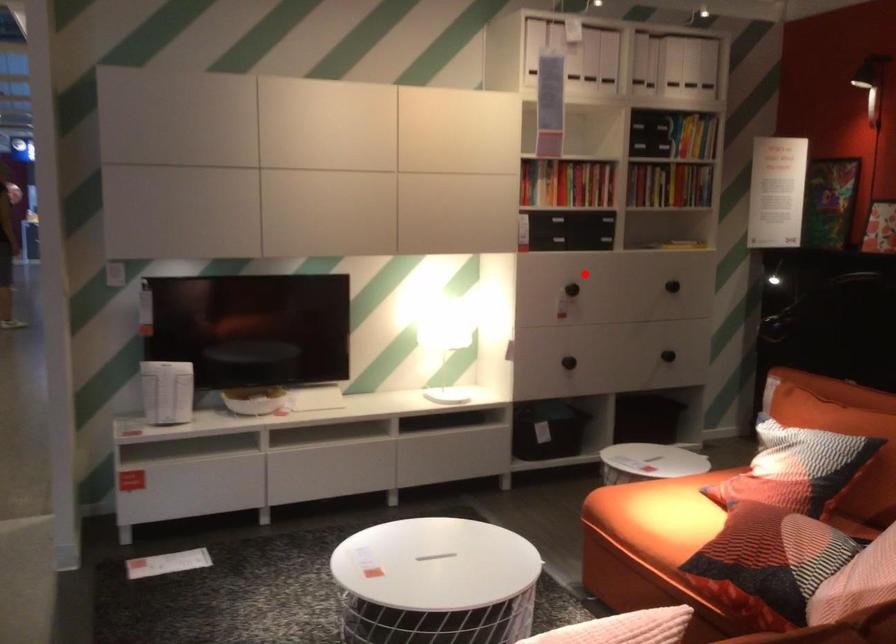
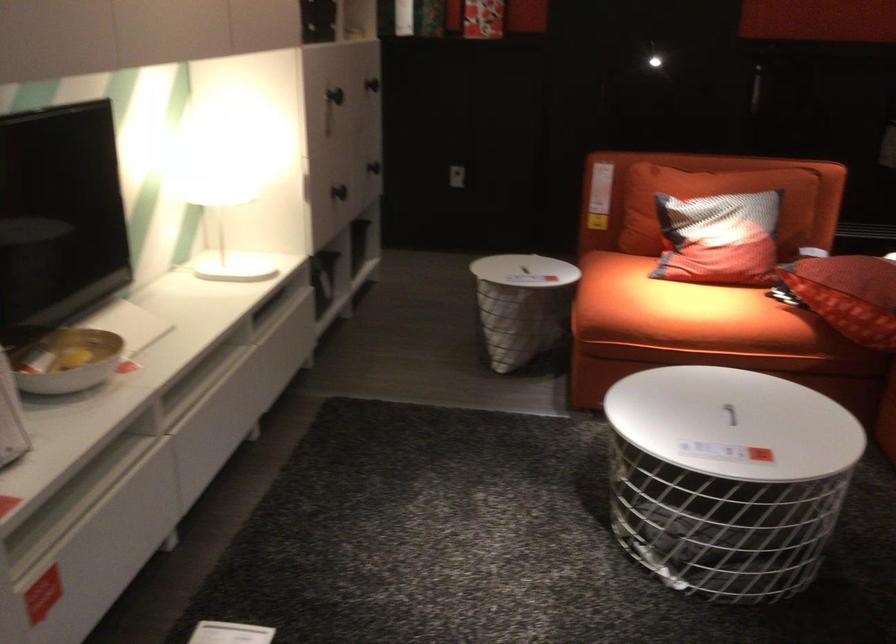
The point at the highlighted location is marked in the first image. Where is the corresponding point in the second image?

(334, 95)